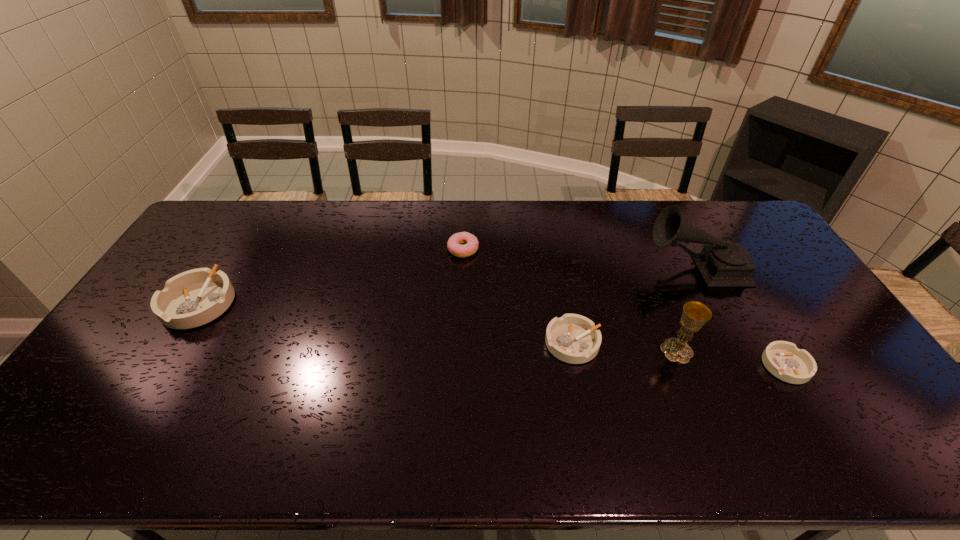
Where is `the fourth shortest object`? the fourth shortest object is located at coordinates (193, 298).

Find the location of a particular element. This screenshot has width=960, height=540. the leftmost ashtray is located at coordinates (193, 298).

The width and height of the screenshot is (960, 540). In order to click on the second ashtray from left to right in this screenshot , I will do `click(572, 338)`.

Identify the location of the second tallest ashtray. (572, 338).

Where is `the shortest ashtray`? The height and width of the screenshot is (540, 960). the shortest ashtray is located at coordinates (783, 359).

Find the location of a particular element. The image size is (960, 540). the shortest object is located at coordinates (783, 359).

Where is `the second tallest object`? This screenshot has width=960, height=540. the second tallest object is located at coordinates (695, 314).

The image size is (960, 540). I want to click on phonograph_record, so click(x=722, y=263).

Where is `doughnut`? This screenshot has height=540, width=960. doughnut is located at coordinates (471, 243).

The height and width of the screenshot is (540, 960). Identify the location of free space located 0.200m on the front of the third tallest object. (144, 393).